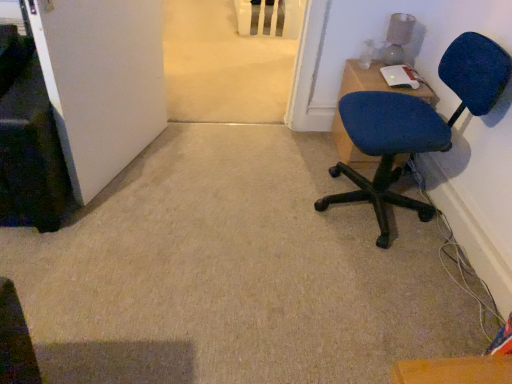
I want to click on free spot to the left of blue fabric chair at upper right, so click(301, 147).